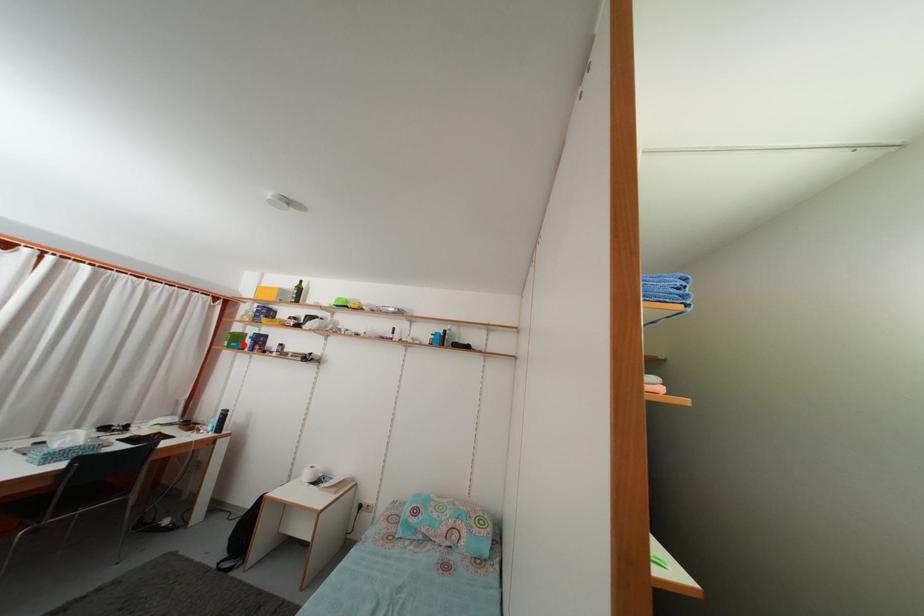
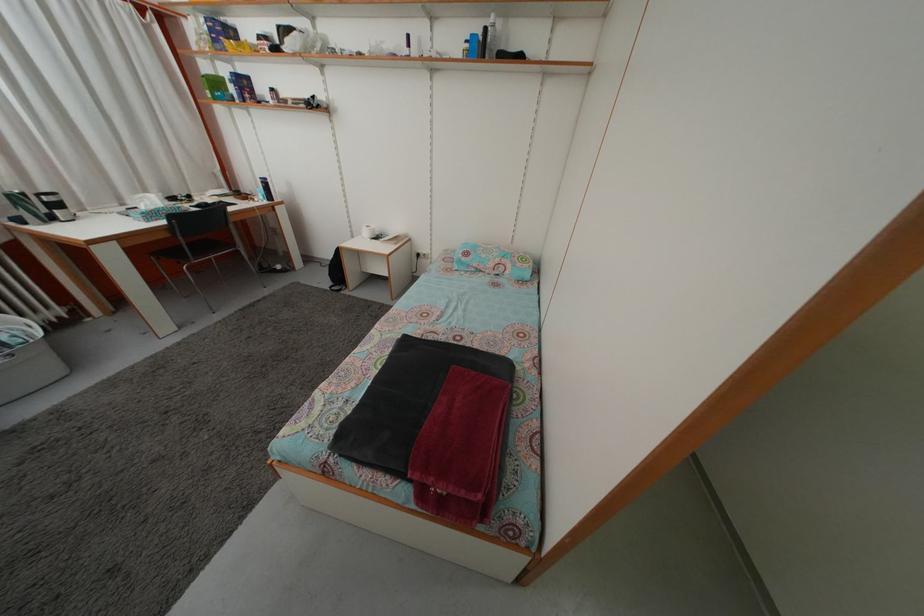
Locate, in the second image, the point that corresponds to the highlighted location in the first image.

(223, 91)